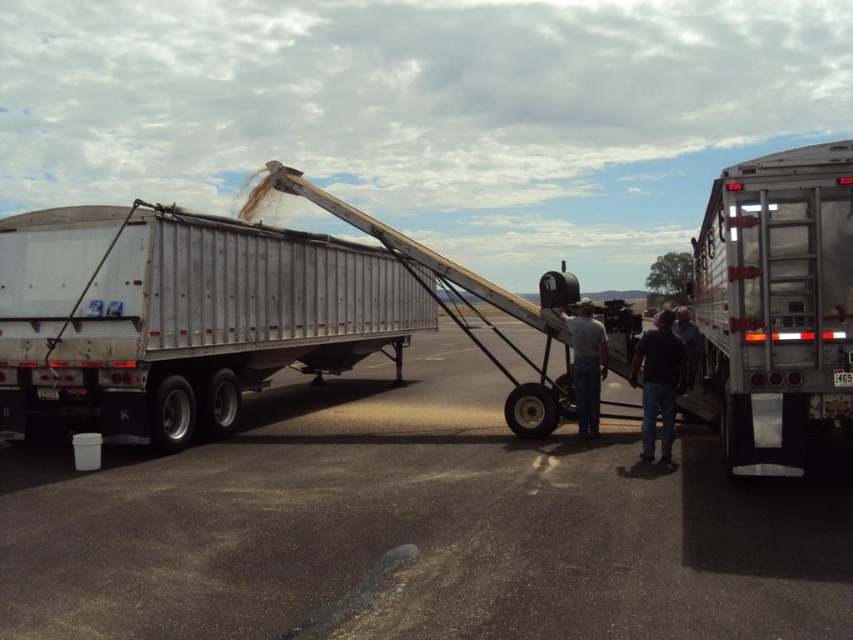
You are a delivery person who needs to move a 5.5 meter long crate from the silver metallic trailer at left to the denim jeans at center. Can you safely transport the crate without it extending beyond the space between them?

The distance between the silver metallic trailer at left and denim jeans at center is 6.10 meters. Since the crate is 5.5 meters long, it will fit within the space as 5.5 is less than 6.10, so yes, you can safely transport the crate without it extending beyond the space between them.